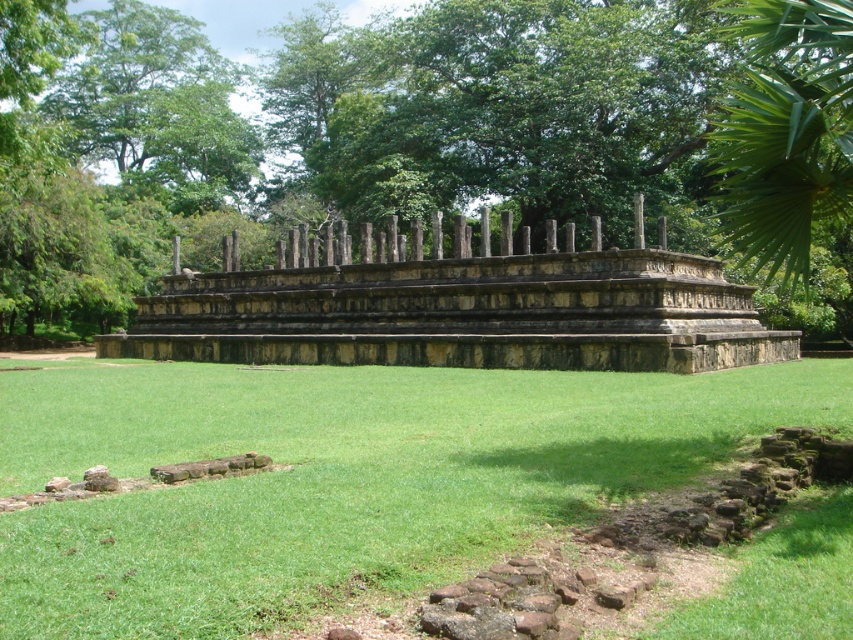
Question: Which point appears closest to the camera in this image?

Choices:
 (A) (64, 417)
 (B) (233, 144)
 (C) (358, 340)

Answer: (A)

Question: Is stone ruins at center below green leafy tree at upper left?

Choices:
 (A) yes
 (B) no

Answer: (A)

Question: Can you confirm if green leafy tree at upper center is wider than green leafy tree at upper left?

Choices:
 (A) no
 (B) yes

Answer: (B)

Question: Which object is positioned farthest from the green grass at center?

Choices:
 (A) stone ruins at center
 (B) green leafy tree at upper left

Answer: (B)

Question: Can you confirm if green leafy tree at upper center is thinner than green grass at center?

Choices:
 (A) yes
 (B) no

Answer: (B)

Question: Among these objects, which one is farthest from the camera?

Choices:
 (A) green leafy tree at upper center
 (B) stone ruins at center

Answer: (B)